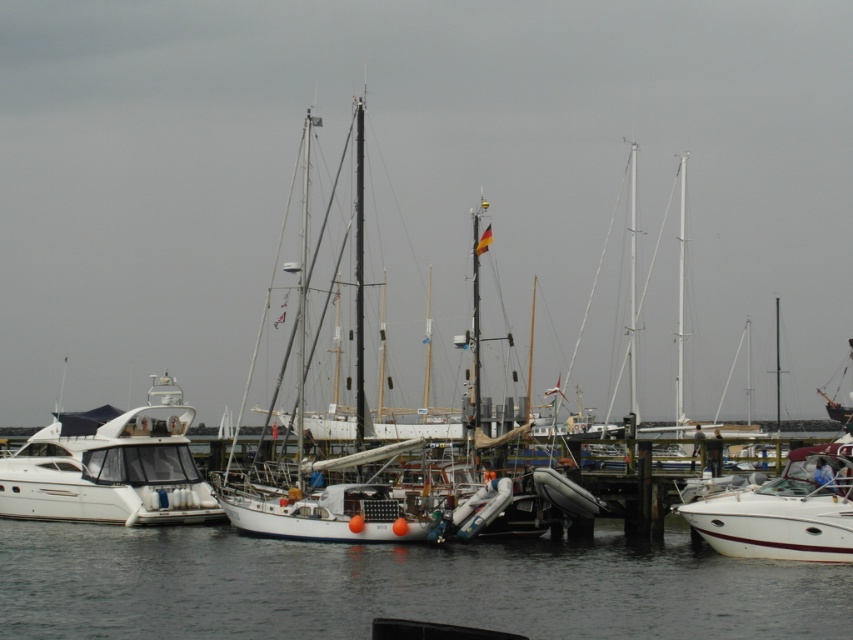
Question: In this image, where is transparent water at center located relative to white glossy motorboat at left?

Choices:
 (A) right
 (B) left

Answer: (A)

Question: Can you confirm if white glossy motorboat at left is thinner than white glossy speedboat at right?

Choices:
 (A) yes
 (B) no

Answer: (B)

Question: Which object is positioned closest to the transparent water at center?

Choices:
 (A) white glossy speedboat at right
 (B) white glossy motorboat at left

Answer: (B)

Question: Which of the following is the closest to the observer?

Choices:
 (A) (93, 609)
 (B) (62, 509)
 (C) (828, 488)

Answer: (A)

Question: Does transparent water at center have a lesser width compared to white glossy motorboat at left?

Choices:
 (A) no
 (B) yes

Answer: (A)

Question: Estimate the real-world distances between objects in this image. Which object is closer to the white glossy motorboat at left?

Choices:
 (A) transparent water at center
 (B) white glossy speedboat at right

Answer: (A)